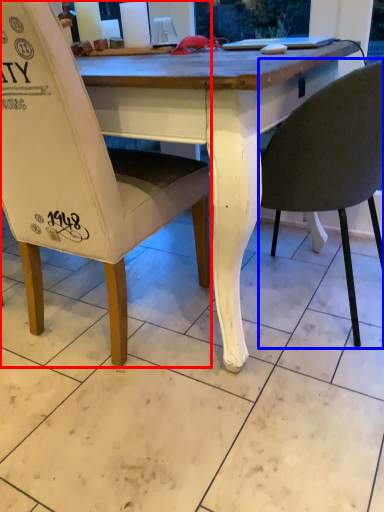
Question: Which object is further to the camera taking this photo, chair (highlighted by a red box) or chair (highlighted by a blue box)?

Choices:
 (A) chair
 (B) chair

Answer: (B)